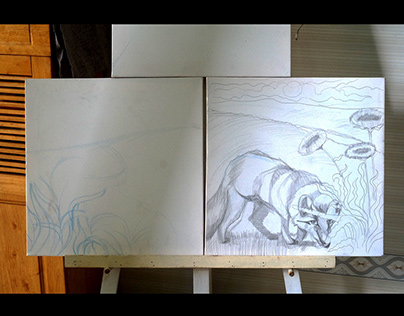
This screenshot has height=316, width=404. I want to click on wood paneling, so click(13, 257).